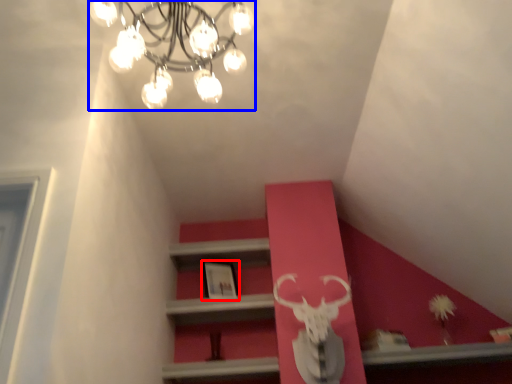
Question: Among these objects, which one is nearest to the camera, picture frame (highlighted by a red box) or lamp (highlighted by a blue box)?

Choices:
 (A) picture frame
 (B) lamp

Answer: (B)